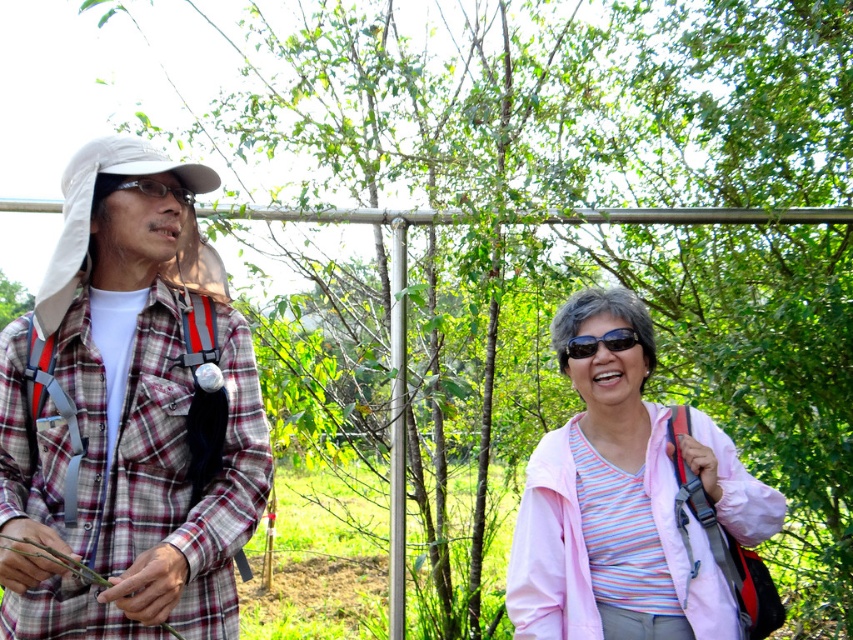
Question: Is plaid fabric shirt at left below black plastic sunglasses at center?

Choices:
 (A) no
 (B) yes

Answer: (B)

Question: Does plaid fabric shirt at left have a smaller size compared to white fabric baseball hat at left?

Choices:
 (A) yes
 (B) no

Answer: (B)

Question: Considering the real-world distances, which object is closest to the plaid fabric shirt at left?

Choices:
 (A) matte black glasses at left
 (B) pink fabric jacket at lower right
 (C) black plastic sunglasses at center
 (D) white fabric baseball hat at left

Answer: (D)

Question: Is plaid fabric shirt at left in front of matte black glasses at left?

Choices:
 (A) no
 (B) yes

Answer: (B)

Question: Which point appears closest to the camera in this image?

Choices:
 (A) (47, 456)
 (B) (64, 244)
 (C) (747, 532)
 (D) (183, 193)

Answer: (A)

Question: Which object appears farthest from the camera in this image?

Choices:
 (A) white fabric baseball hat at left
 (B) matte black glasses at left

Answer: (B)